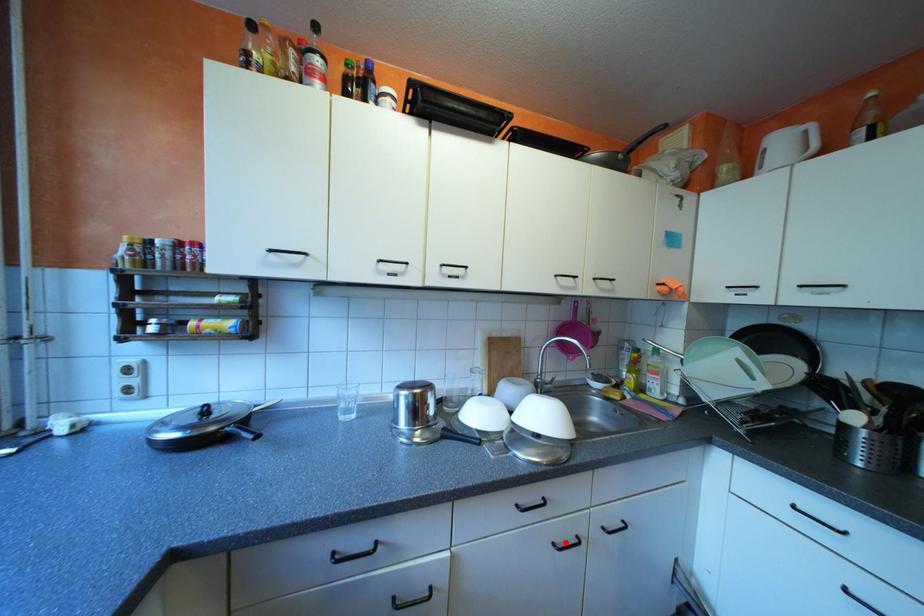
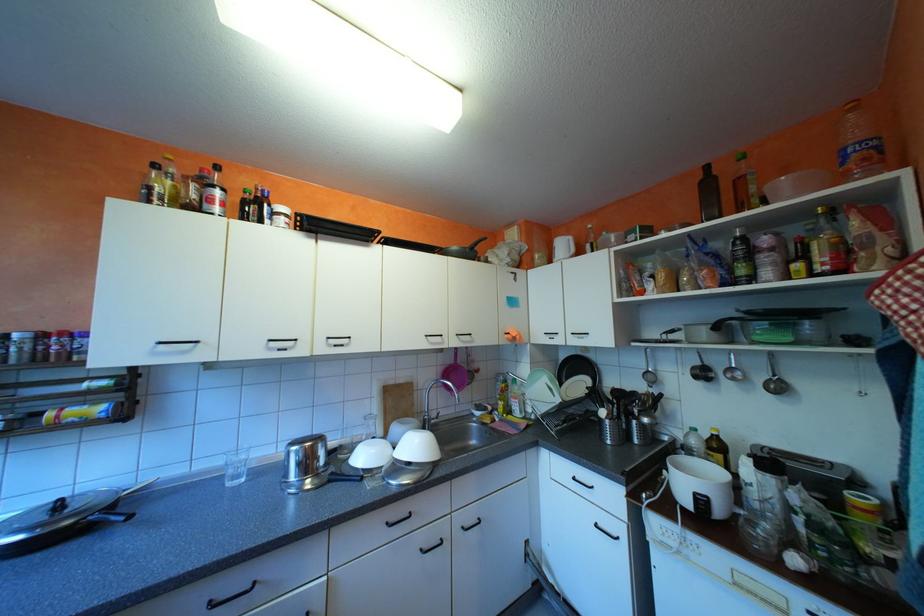
Locate, in the second image, the point that corresponds to the highlighted location in the first image.

(432, 549)